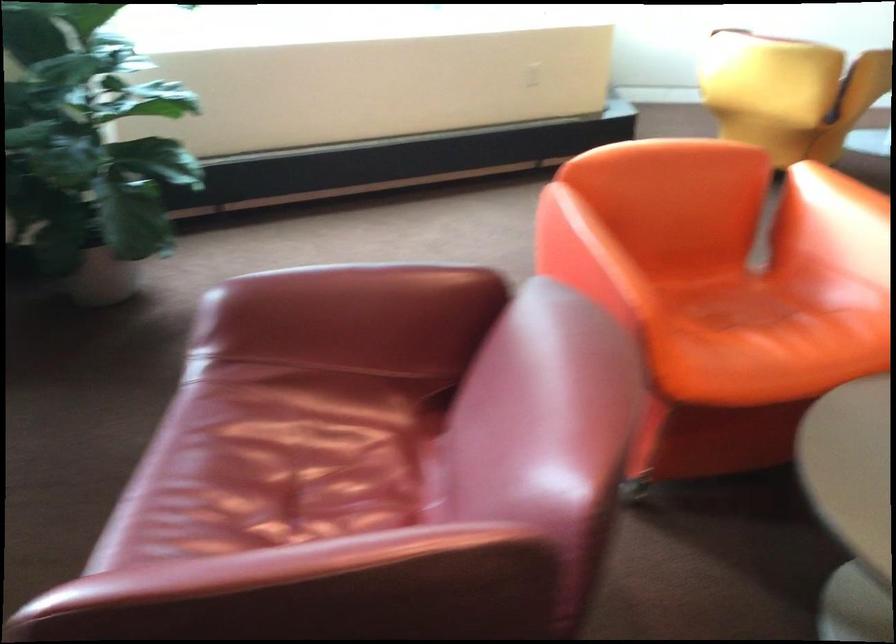
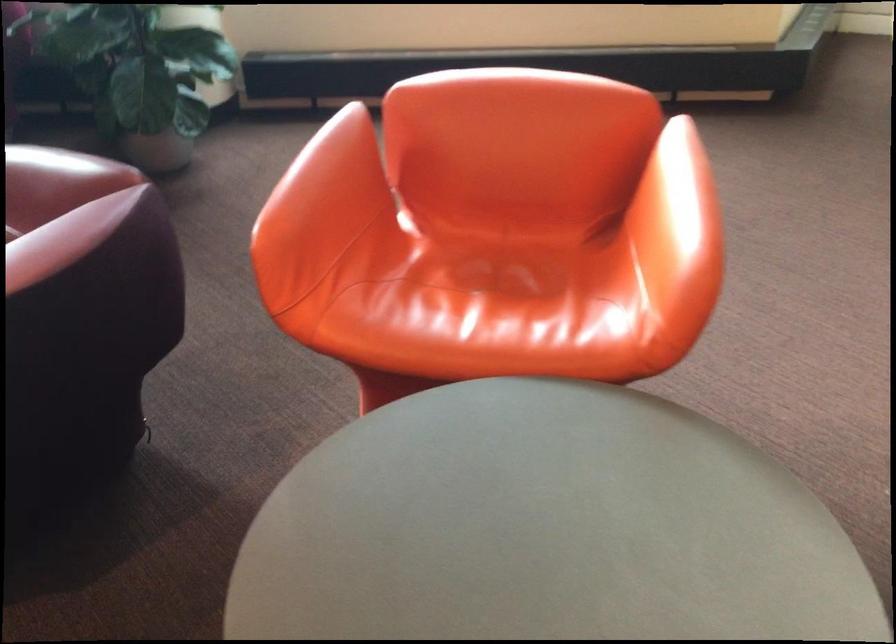
The point at (711, 301) is marked in the first image. Where is the corresponding point in the second image?

(487, 261)